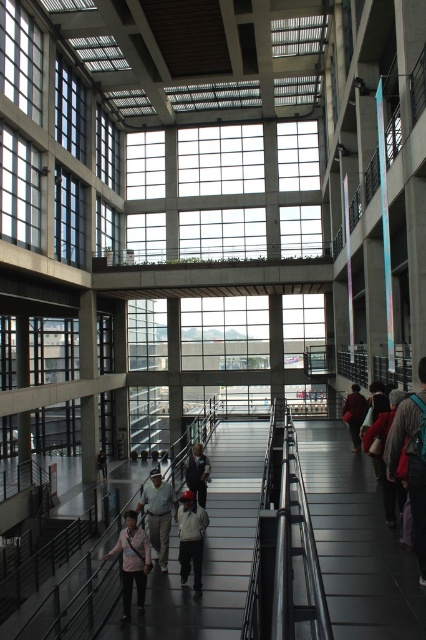
Is point (416, 449) closer to viewer compared to point (144, 545)?

Yes, point (416, 449) is in front of point (144, 545).

Which is in front, point (400, 410) or point (123, 540)?

Positioned in front is point (400, 410).

Does point (423, 484) come behind point (129, 554)?

No, (423, 484) is closer to viewer.

Find the location of `dark gray backpack at right`. dark gray backpack at right is located at coordinates (411, 460).

From the picture: Is metallic gray escalator at center thinner than dark gray sweater at right?

No, metallic gray escalator at center is not thinner than dark gray sweater at right.

Who is positioned more to the left, metallic gray escalator at center or dark gray sweater at right?

From the viewer's perspective, metallic gray escalator at center appears more on the left side.

Which is behind, point (222, 499) or point (408, 465)?

The point (222, 499) is more distant.

In order to click on metallic gray escalator at center in this screenshot , I will do `click(210, 548)`.

Which is behind, point (414, 454) or point (118, 545)?

The point (118, 545) is more distant.

Between point (385, 474) and point (141, 600), which one is positioned in front?

Point (385, 474)

What are the coordinates of `dark gray sweater at right` in the screenshot? It's located at (411, 460).